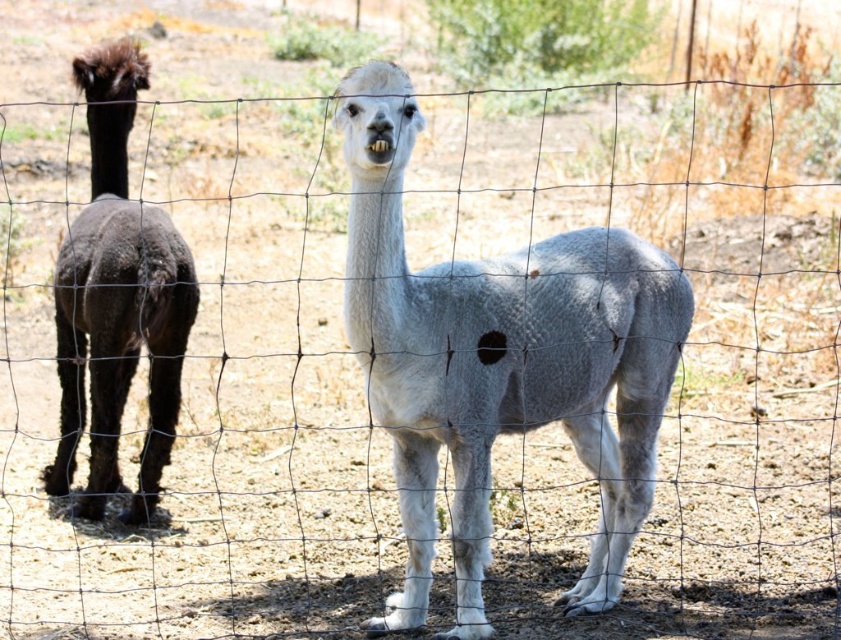
You are a farmer checking the alpacas in the field. You notice the white woolen alpaca at center and the dark brown woolly alpaca at left. Which alpaca is shorter?

The white woolen alpaca at center is shorter than the dark brown woolly alpaca at left.

Looking at this image, you are standing in front of a fence where two alpacas are present. You notice an alpaca with white wool at the center. Can you tell me the exact coordinates of the white woolen alpaca at center?

The white woolen alpaca at center is located at coordinates point [500,362].